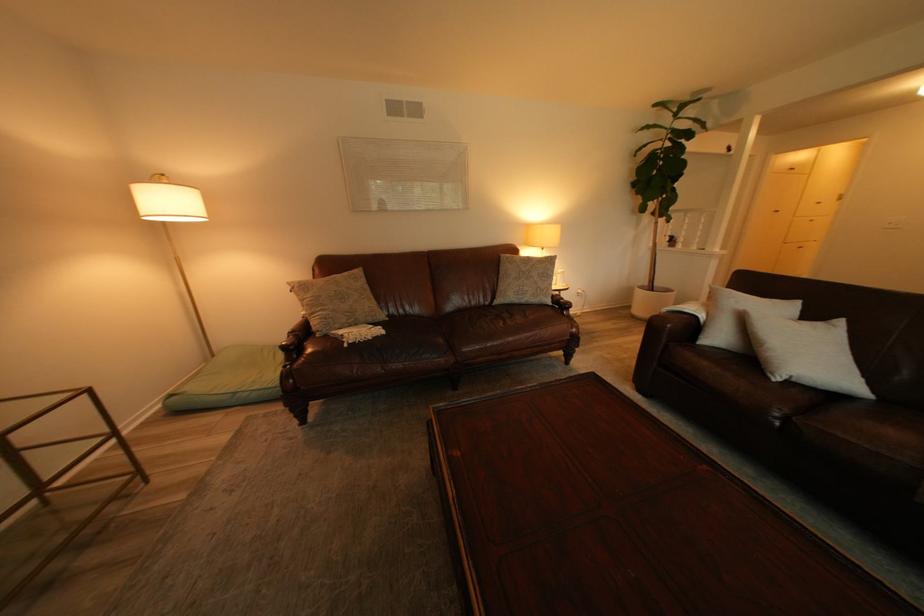
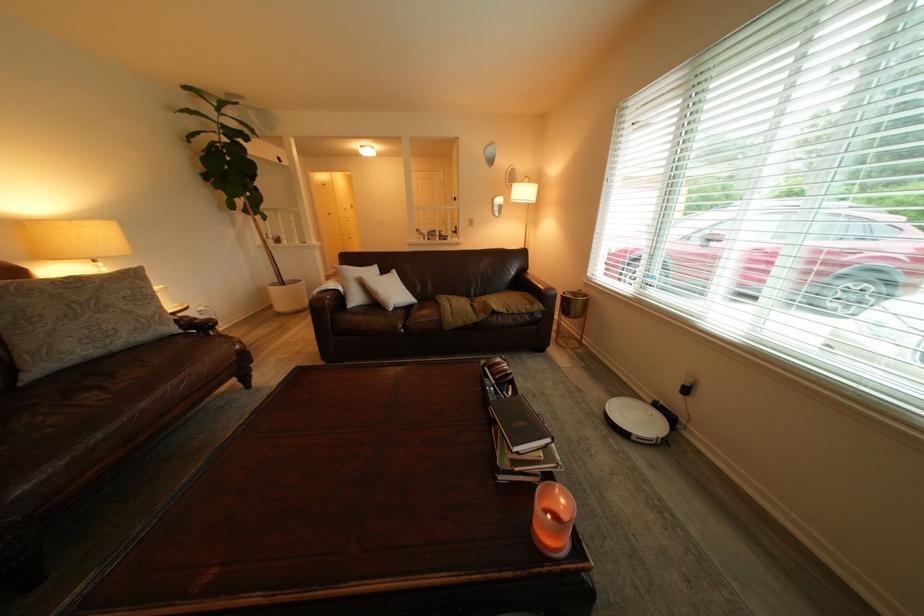
The point at (529, 294) is marked in the first image. Where is the corresponding point in the second image?

(101, 342)